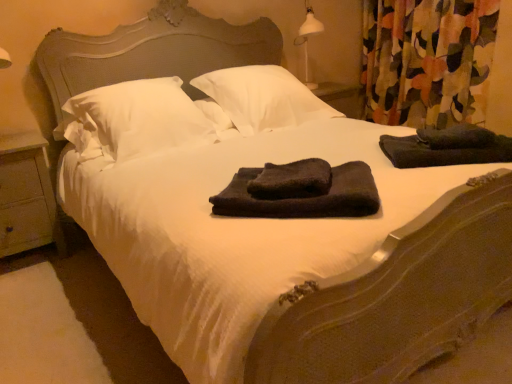
This screenshot has height=384, width=512. What are the coordinates of `wooden at left` in the screenshot? It's located at (27, 196).

What is the approximate height of wooden at left?

25.49 inches.

Describe the element at coordinates (134, 120) in the screenshot. I see `white soft pillow at center, which is the first pillow from left to right` at that location.

I want to click on white soft pillow at center, the 2th pillow from the right, so click(134, 120).

What is the approximate width of dark gray plush bath towel at center, the second bath towel when ordered from right to left?

dark gray plush bath towel at center, the second bath towel when ordered from right to left, is 10.72 inches in width.

The width and height of the screenshot is (512, 384). Find the location of `dark gray plush bath towel at center, marked as the 1th bath towel in a left-to-right arrangement`. dark gray plush bath towel at center, marked as the 1th bath towel in a left-to-right arrangement is located at coordinates (292, 180).

What do you see at coordinates (426, 60) in the screenshot? I see `floral fabric curtain at upper right` at bounding box center [426, 60].

Identify the location of wooden at left. Image resolution: width=512 pixels, height=384 pixels. (27, 196).

In the scene shown: Is white soft pillow at center, the 2th pillow from the left, beside white soft pillow at center, the 2th pillow from the right?

No, white soft pillow at center, the 2th pillow from the left, is not in contact with white soft pillow at center, the 2th pillow from the right.

Can you tell me how much white soft pillow at center, which appears as the first pillow when viewed from the right, and white soft pillow at center, which is the first pillow from left to right, differ in facing direction?

white soft pillow at center, which appears as the first pillow when viewed from the right, and white soft pillow at center, which is the first pillow from left to right, are facing 0.000886 degrees away from each other.

From a real-world perspective, is white soft pillow at center, which appears as the first pillow when viewed from the right, positioned above or below white soft pillow at center, the 2th pillow from the right?

In terms of real-world spatial position, white soft pillow at center, which appears as the first pillow when viewed from the right, is above white soft pillow at center, the 2th pillow from the right.

Is dark gray plush bath towel at center, marked as the 1th bath towel in a left-to-right arrangement, located outside dark gray towel at right?

Absolutely, dark gray plush bath towel at center, marked as the 1th bath towel in a left-to-right arrangement, is external to dark gray towel at right.

Based on the photo, looking at their sizes, would you say dark gray plush bath towel at center, the second bath towel when ordered from right to left, is wider or thinner than dark gray towel at right?

dark gray plush bath towel at center, the second bath towel when ordered from right to left, is thinner than dark gray towel at right.

From a real-world perspective, is dark gray plush bath towel at center, marked as the 1th bath towel in a left-to-right arrangement, located beneath dark gray towel at right?

Actually, dark gray plush bath towel at center, marked as the 1th bath towel in a left-to-right arrangement, is physically above dark gray towel at right in the real world.

Measure the distance between white soft pillow at center, which appears as the first pillow when viewed from the right, and dark gray plush bath towel at center, placed as the second bath towel when sorted from left to right.

A distance of 3.42 feet exists between white soft pillow at center, which appears as the first pillow when viewed from the right, and dark gray plush bath towel at center, placed as the second bath towel when sorted from left to right.

Is white soft pillow at center, the 2th pillow from the left, positioned far away from dark gray plush bath towel at center, arranged as the first bath towel when viewed from the right?

Yes, white soft pillow at center, the 2th pillow from the left, is far from dark gray plush bath towel at center, arranged as the first bath towel when viewed from the right.

From the image's perspective, between white soft pillow at center, the 2th pillow from the left, and dark gray plush bath towel at center, placed as the second bath towel when sorted from left to right, who is located below?

dark gray plush bath towel at center, placed as the second bath towel when sorted from left to right.

How different are the orientations of white soft pillow at center, which appears as the first pillow when viewed from the right, and dark gray plush bath towel at center, placed as the second bath towel when sorted from left to right, in degrees?

44.8 degrees.

Which is farther, (398, 5) or (275, 207)?

The point (398, 5) is behind.

From the image's perspective, which one is positioned higher, floral fabric curtain at upper right or dark gray plush bath towel at center, placed as the second bath towel when sorted from left to right?

floral fabric curtain at upper right is shown above in the image.

Is floral fabric curtain at upper right wider or thinner than dark gray plush bath towel at center, arranged as the first bath towel when viewed from the right?

In the image, floral fabric curtain at upper right appears to be more narrow than dark gray plush bath towel at center, arranged as the first bath towel when viewed from the right.

From a real-world perspective, is floral fabric curtain at upper right on top of dark gray plush bath towel at center, arranged as the first bath towel when viewed from the right?

Correct, in the physical world, floral fabric curtain at upper right is higher than dark gray plush bath towel at center, arranged as the first bath towel when viewed from the right.

From a real-world perspective, is dark gray plush bath towel at center, the second bath towel when ordered from right to left, located higher than wooden at left?

Indeed, from a real-world perspective, dark gray plush bath towel at center, the second bath towel when ordered from right to left, stands above wooden at left.

Is dark gray plush bath towel at center, the second bath towel when ordered from right to left, thinner than wooden at left?

Indeed, dark gray plush bath towel at center, the second bath towel when ordered from right to left, has a lesser width compared to wooden at left.

Which object is positioned more to the left, dark gray plush bath towel at center, marked as the 1th bath towel in a left-to-right arrangement, or wooden at left?

wooden at left.

Considering the sizes of objects dark gray plush bath towel at center, marked as the 1th bath towel in a left-to-right arrangement, and wooden at left in the image provided, who is bigger, dark gray plush bath towel at center, marked as the 1th bath towel in a left-to-right arrangement, or wooden at left?

wooden at left is bigger.

Would you say white soft pillow at center, which is the first pillow from left to right, is part of wooden at left's contents?

No, wooden at left does not contain white soft pillow at center, which is the first pillow from left to right.

Is wooden at left further to camera compared to white soft pillow at center, which is the first pillow from left to right?

Yes.

Does wooden at left turn towards white soft pillow at center, the 2th pillow from the right?

No.

How different are the orientations of wooden at left and white soft pillow at center, the 2th pillow from the right, in degrees?

0.215 degrees separate the facing orientations of wooden at left and white soft pillow at center, the 2th pillow from the right.

Which of these two, white soft pillow at center, which appears as the first pillow when viewed from the right, or dark gray plush bath towel at center, marked as the 1th bath towel in a left-to-right arrangement, is bigger?

With larger size is white soft pillow at center, which appears as the first pillow when viewed from the right.

Is white soft pillow at center, which appears as the first pillow when viewed from the right, completely or partially outside of dark gray plush bath towel at center, marked as the 1th bath towel in a left-to-right arrangement?

Indeed, white soft pillow at center, which appears as the first pillow when viewed from the right, is completely outside dark gray plush bath towel at center, marked as the 1th bath towel in a left-to-right arrangement.

From the image's perspective, is white soft pillow at center, the 2th pillow from the left, above or below dark gray plush bath towel at center, marked as the 1th bath towel in a left-to-right arrangement?

From the image's perspective, white soft pillow at center, the 2th pillow from the left, appears above dark gray plush bath towel at center, marked as the 1th bath towel in a left-to-right arrangement.

Which of these two, white soft pillow at center, the 2th pillow from the left, or dark gray plush bath towel at center, the second bath towel when ordered from right to left, is wider?

white soft pillow at center, the 2th pillow from the left.

I want to click on pillow above the white soft pillow at center, the 2th pillow from the right (from the image's perspective), so click(x=263, y=98).

Where is `the 1st bath towel positioned below the dark gray towel at right (from the image's perspective)`? The image size is (512, 384). the 1st bath towel positioned below the dark gray towel at right (from the image's perspective) is located at coordinates (292, 180).

When comparing their distances from dark gray plush bath towel at center, the second bath towel when ordered from right to left, does wooden at left or white soft pillow at center, the 2th pillow from the right, seem closer?

white soft pillow at center, the 2th pillow from the right, lies closer to dark gray plush bath towel at center, the second bath towel when ordered from right to left, than the other object.

Considering their positions, is dark gray plush bath towel at center, arranged as the first bath towel when viewed from the right, positioned closer to white soft pillow at center, the 2th pillow from the left, than white soft pillow at center, which is the first pillow from left to right?

white soft pillow at center, which is the first pillow from left to right, is closer to white soft pillow at center, the 2th pillow from the left.

Estimate the real-world distances between objects in this image. Which object is further from white soft pillow at center, the 2th pillow from the right, dark gray towel at right or dark gray plush bath towel at center, marked as the 1th bath towel in a left-to-right arrangement?

Among the two, dark gray towel at right is located further to white soft pillow at center, the 2th pillow from the right.

Based on their spatial positions, is dark gray towel at right or wooden at left further from white soft pillow at center, which appears as the first pillow when viewed from the right?

Among the two, wooden at left is located further to white soft pillow at center, which appears as the first pillow when viewed from the right.

From the image, which object appears to be nearer to dark gray plush bath towel at center, placed as the second bath towel when sorted from left to right, dark gray towel at right or floral fabric curtain at upper right?

The object closer to dark gray plush bath towel at center, placed as the second bath towel when sorted from left to right, is dark gray towel at right.

Which object lies further to the anchor point white soft pillow at center, the 2th pillow from the right, dark gray plush bath towel at center, the second bath towel when ordered from right to left, or white soft pillow at center, which appears as the first pillow when viewed from the right?

Based on the image, dark gray plush bath towel at center, the second bath towel when ordered from right to left, appears to be further to white soft pillow at center, the 2th pillow from the right.

Which object lies nearer to the anchor point dark gray plush bath towel at center, placed as the second bath towel when sorted from left to right, dark gray towel at right or white soft pillow at center, the 2th pillow from the right?

dark gray towel at right is positioned closer to the anchor dark gray plush bath towel at center, placed as the second bath towel when sorted from left to right.

From the image, which object appears to be farther from dark gray towel at right, wooden at left or dark gray plush bath towel at center, arranged as the first bath towel when viewed from the right?

wooden at left.

The image size is (512, 384). I want to click on pillow between wooden at left and white soft pillow at center, the 2th pillow from the left, from left to right, so click(134, 120).

At what (x,y) coordinates should I click in order to perform the action: click on material between white soft pillow at center, which is the first pillow from left to right, and floral fabric curtain at upper right. Please return your answer as a coordinate pair (x, y). This screenshot has height=384, width=512. Looking at the image, I should click on (447, 147).

Image resolution: width=512 pixels, height=384 pixels. I want to click on pillow located between dark gray plush bath towel at center, the second bath towel when ordered from right to left, and white soft pillow at center, which appears as the first pillow when viewed from the right, in the depth direction, so click(134, 120).

The image size is (512, 384). What are the coordinates of `bath towel between dark gray plush bath towel at center, the second bath towel when ordered from right to left, and dark gray towel at right` in the screenshot? It's located at (304, 197).